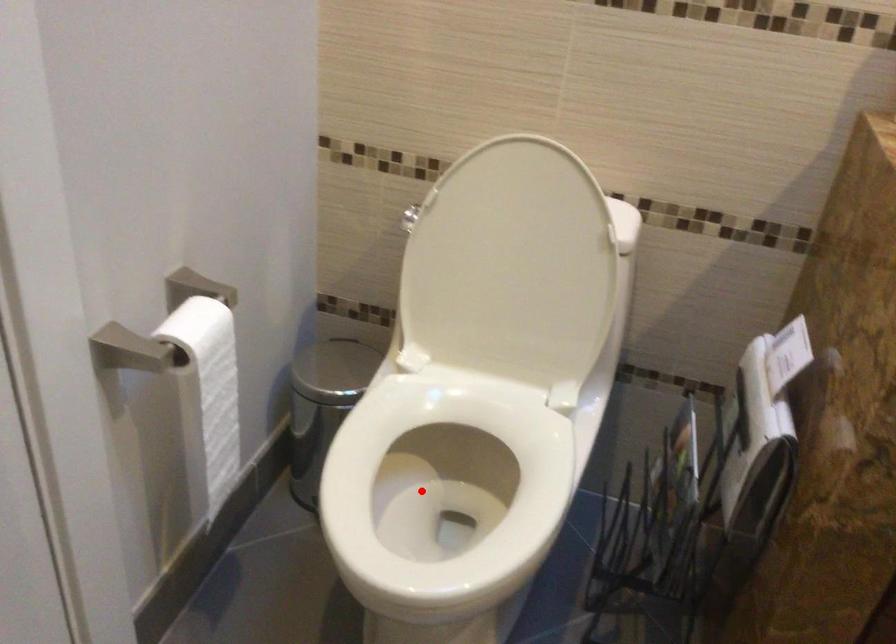
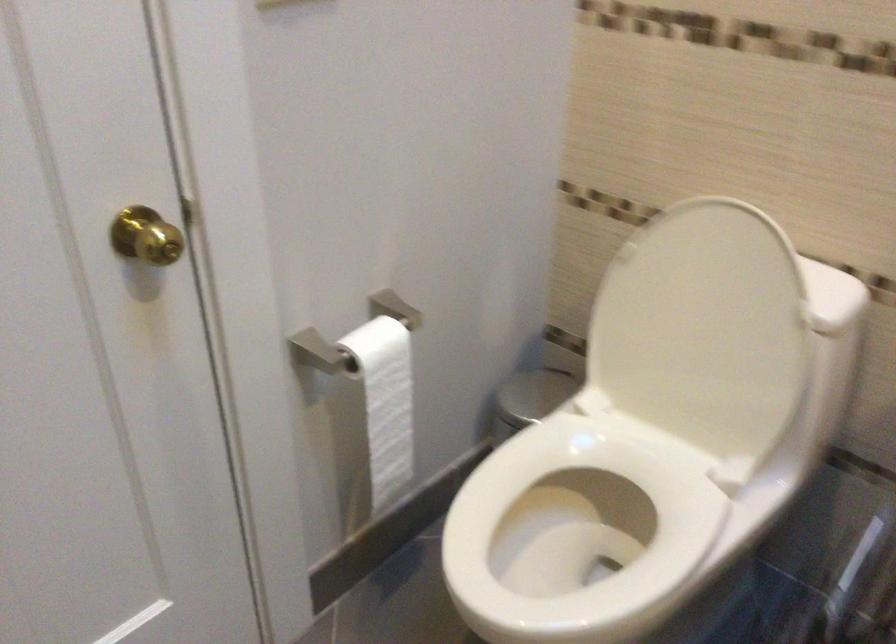
Where in the second image is the point corresponding to the highlighted location from the first image?

(581, 531)